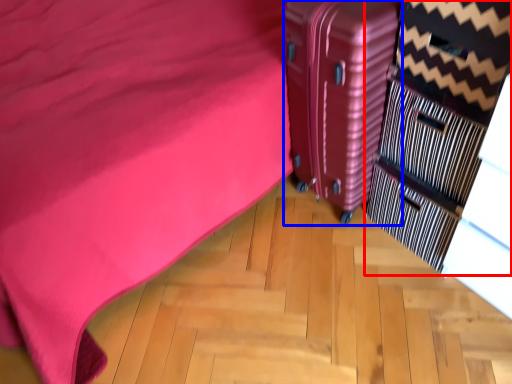
Question: Which object is closer to the camera taking this photo, dresser (highlighted by a red box) or suitcase (highlighted by a blue box)?

Choices:
 (A) dresser
 (B) suitcase

Answer: (A)